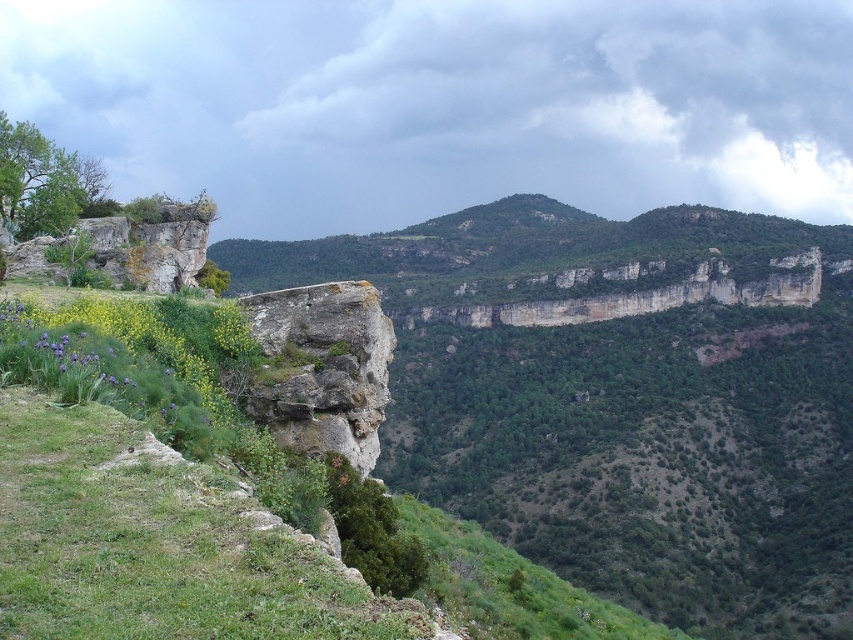
Question: Which of the following is the closest to the observer?

Choices:
 (A) (231, 474)
 (B) (286, 346)

Answer: (A)

Question: Among these objects, which one is farthest from the camera?

Choices:
 (A) rusty stone cliff at center
 (B) green grassy at lower left

Answer: (A)

Question: Does green grassy at lower left lie in front of rusty stone cliff at center?

Choices:
 (A) yes
 (B) no

Answer: (A)

Question: Does green grassy at lower left appear on the right side of rusty stone cliff at center?

Choices:
 (A) no
 (B) yes

Answer: (A)

Question: Which point is farther to the camera?

Choices:
 (A) rusty stone cliff at center
 (B) green grassy at lower left

Answer: (A)

Question: Is green grassy at lower left to the right of rusty stone cliff at center from the viewer's perspective?

Choices:
 (A) yes
 (B) no

Answer: (B)